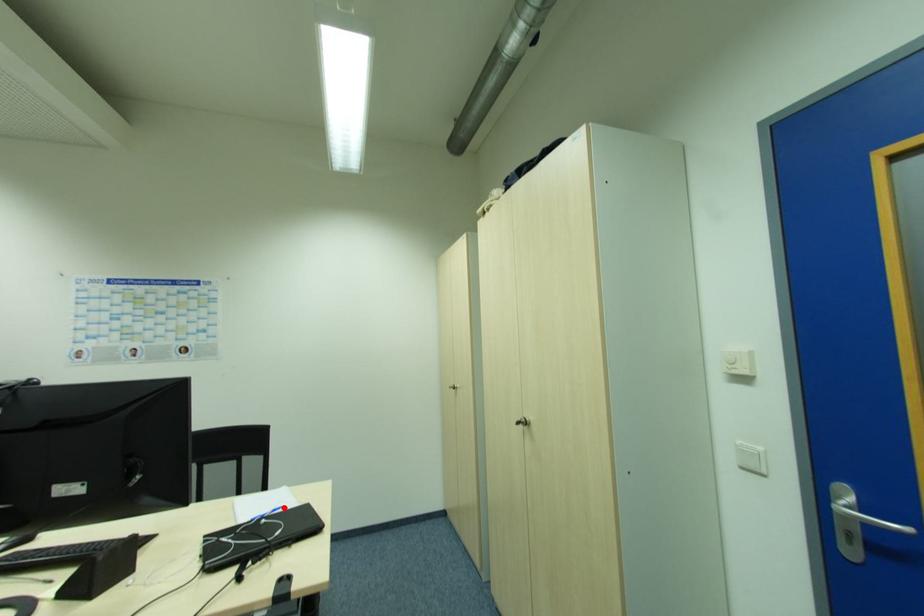
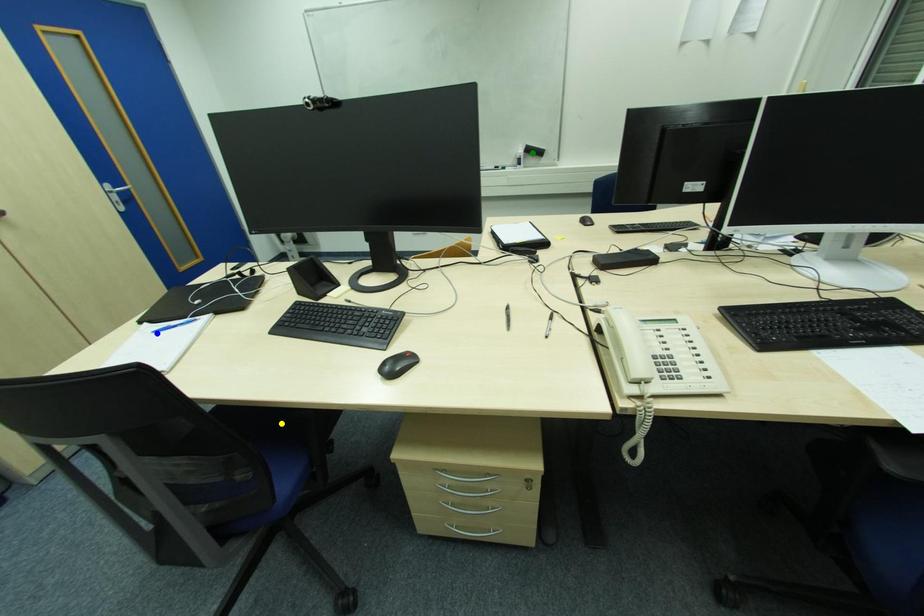
Question: I am providing you with two images of the same scene from different viewpoints. A red point is marked on the first image. You are given multiple points on the second image. Which point in image 2 represents the same 3d spot as the red point in image 1?

Choices:
 (A) blue point
 (B) green point
 (C) yellow point

Answer: (A)